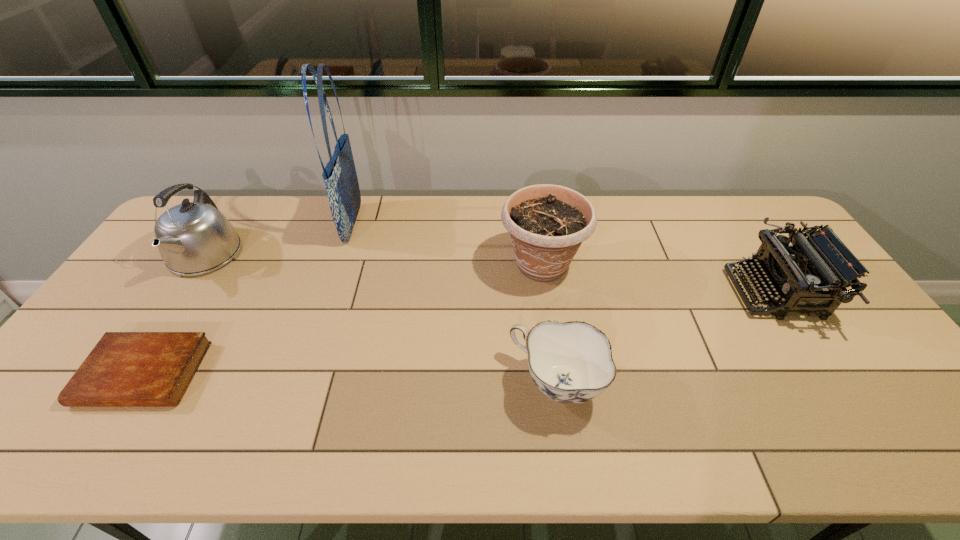
Find the location of a particular element. The image size is (960, 540). shopping bag is located at coordinates (342, 188).

This screenshot has height=540, width=960. In order to click on the tallest object in this screenshot , I will do `click(342, 188)`.

Identify the location of kettle. This screenshot has width=960, height=540. (193, 238).

Where is `flowerpot`? flowerpot is located at coordinates tap(548, 223).

Identify the location of typewriter. (808, 278).

Where is `chinaware`? This screenshot has height=540, width=960. chinaware is located at coordinates (571, 362).

Find the location of a particular element. the shortest object is located at coordinates (125, 369).

You are a GUI agent. You are given a task and a screenshot of the screen. Output one action in this format:
    pyautogui.click(x=<x>, y=<y>)
    Task: Click on the vacant space situated 0.330m on the front-facing side of the shopping bag
    This screenshot has width=960, height=540.
    Given the screenshot: What is the action you would take?
    pyautogui.click(x=457, y=224)

Find the location of a particular element. This screenshot has width=960, height=540. free region located on the spout of the kettle is located at coordinates (164, 317).

The height and width of the screenshot is (540, 960). Identify the location of free space located 0.130m on the right of the flowerpot. (627, 265).